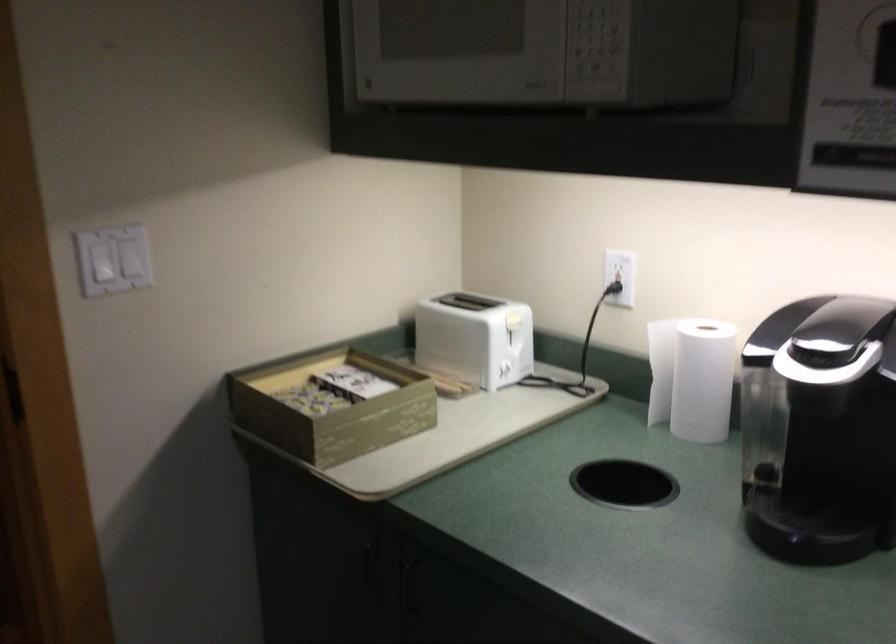
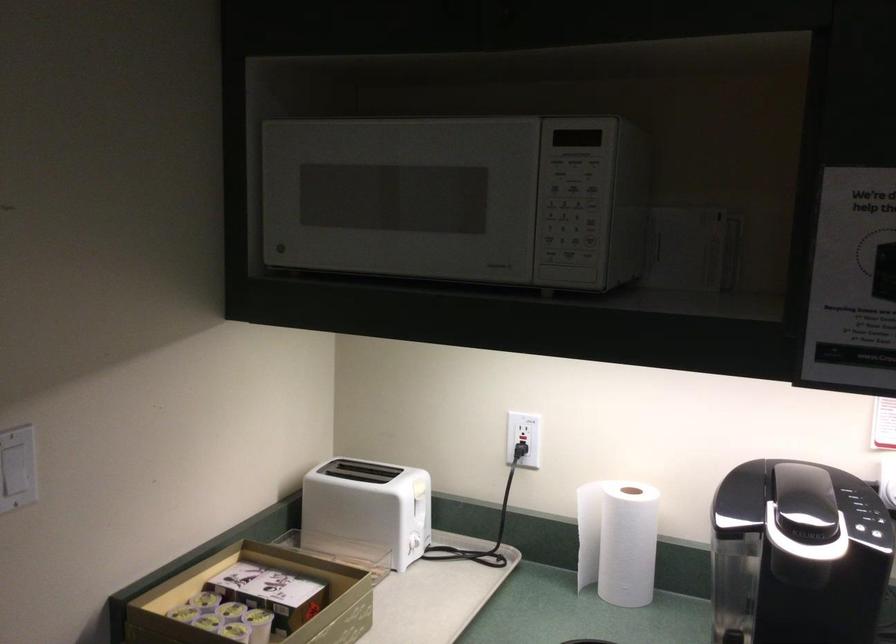
The point at (596, 90) is marked in the first image. Where is the corresponding point in the second image?

(565, 279)